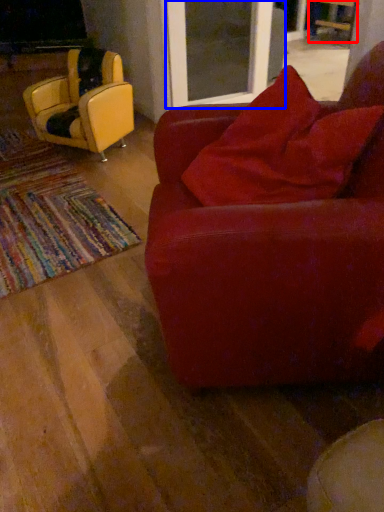
Question: Which object is further to the camera taking this photo, chair (highlighted by a red box) or screen door (highlighted by a blue box)?

Choices:
 (A) chair
 (B) screen door

Answer: (A)